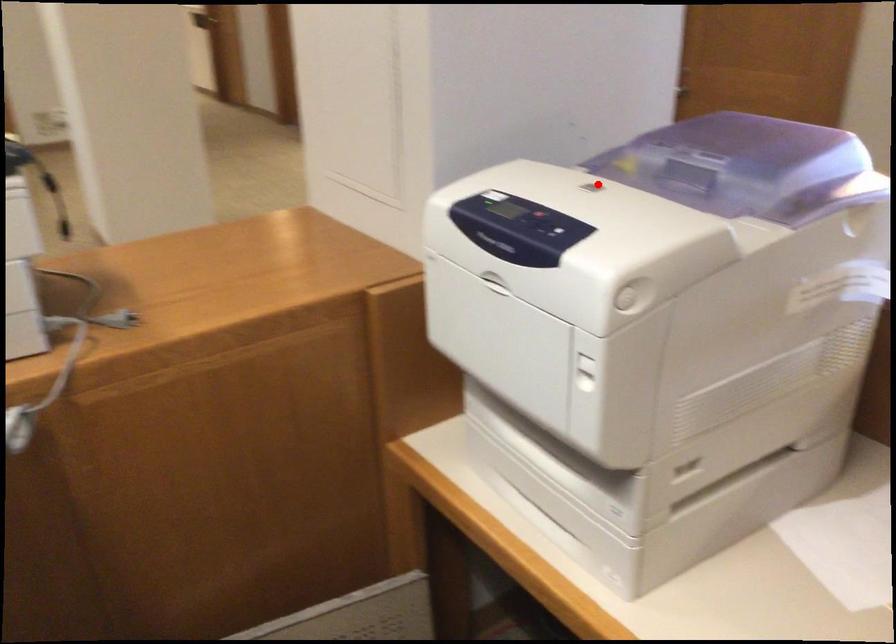
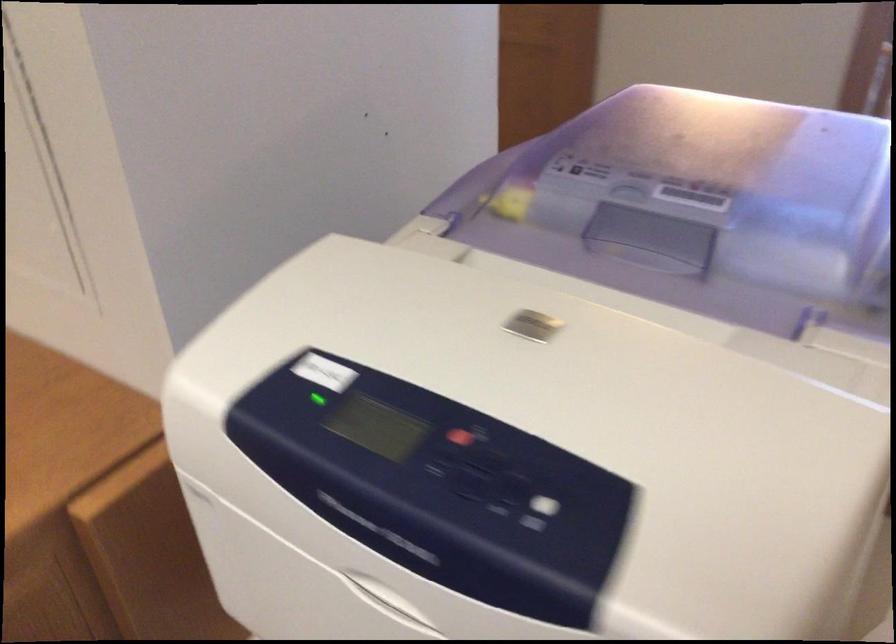
In the second image, find the point that corresponds to the highlighted location in the first image.

(539, 325)